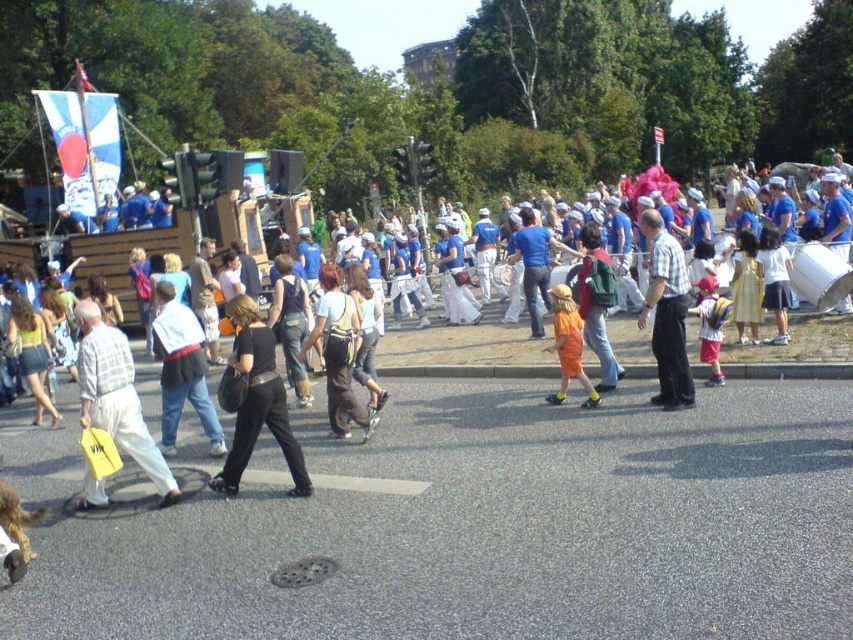
Question: Can you confirm if black matte pants at center is positioned below orange cotton shirt at center?

Choices:
 (A) no
 (B) yes

Answer: (B)

Question: Which point is farther to the camera?

Choices:
 (A) (274, 388)
 (B) (683, 328)
 (C) (190, 387)

Answer: (C)

Question: Can you confirm if black leather pants at center is positioned below orange cotton shirt at center?

Choices:
 (A) no
 (B) yes

Answer: (B)

Question: Which of these objects is positioned farthest from the black matte pants at center?

Choices:
 (A) black leather pants at center
 (B) orange cotton shirt at center
 (C) light gray plaid shirt at center

Answer: (B)

Question: Can you confirm if denim pants at center is wider than black leather pants at center?

Choices:
 (A) no
 (B) yes

Answer: (A)

Question: Which object appears farthest from the camera in this image?

Choices:
 (A) black leather pants at center
 (B) plaid shirt at center
 (C) denim pants at center
 (D) light gray plaid shirt at center

Answer: (C)